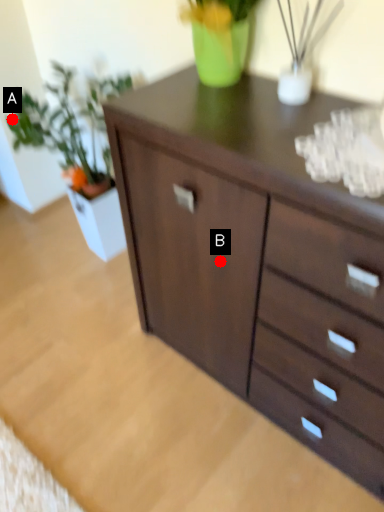
Question: Two points are circled on the image, labeled by A and B beside each circle. Among these points, which one is nearest to the camera?

Choices:
 (A) A is closer
 (B) B is closer

Answer: (B)